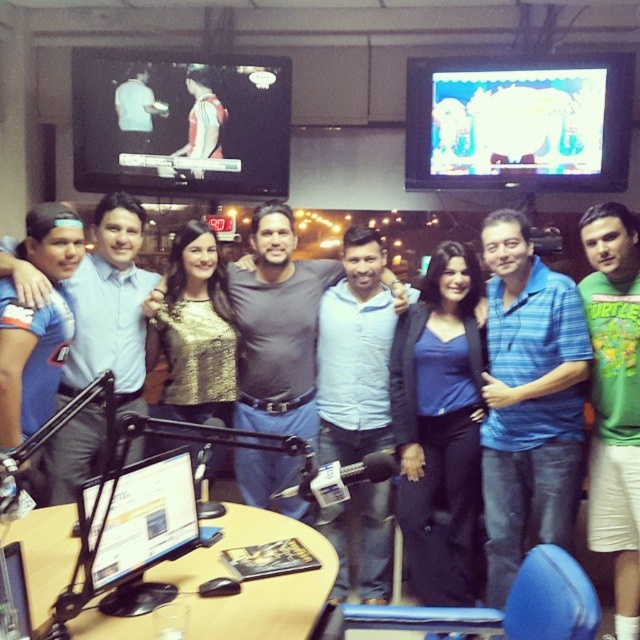
Between point (502, 545) and point (10, 358), which one is positioned in front?

Point (10, 358) is more forward.

Is blue striped polo shirt at center taller than matte blue shirt at center?

Yes.

You are a GUI agent. You are given a task and a screenshot of the screen. Output one action in this format:
    pyautogui.click(x=<x>, y=<y>)
    Task: Click on the blue striped polo shirt at center
    Image resolution: width=640 pixels, height=640 pixels.
    Given the screenshot: What is the action you would take?
    pyautogui.click(x=529, y=401)

Does blue matte shirt at center have a lesser height compared to matte blue shirt at center?

No, blue matte shirt at center is not shorter than matte blue shirt at center.

Is blue matte shirt at center further to camera compared to matte blue shirt at center?

That is True.

Which is behind, point (451, 403) or point (49, 216)?

Point (451, 403)

Locate an element on the screen. blue matte shirt at center is located at coordinates (440, 426).

Based on the photo, between gray matte shirt at center and green cotton shirt at center, which one is positioned higher?

gray matte shirt at center is above.

Between gray matte shirt at center and green cotton shirt at center, which one appears on the left side from the viewer's perspective?

Positioned to the left is gray matte shirt at center.

Who is more distant from viewer, (243, 294) or (624, 323)?

Point (243, 294)

Find the location of a particular element. The width and height of the screenshot is (640, 640). gray matte shirt at center is located at coordinates (276, 326).